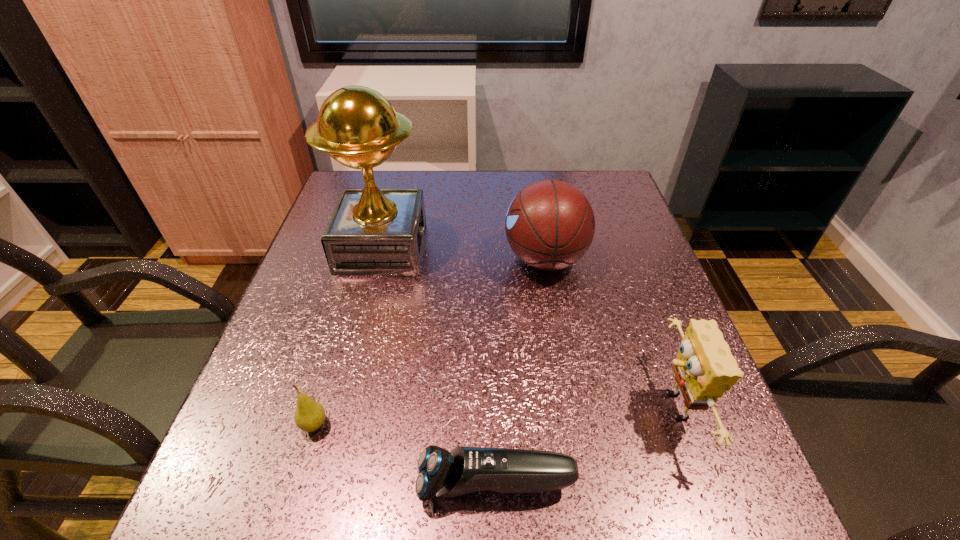
You are a GUI agent. You are given a task and a screenshot of the screen. Output one action in this format:
    pyautogui.click(x=<x>, y=<y>)
    Task: Click on the free space located 0.350m on the face of the sponge
    This screenshot has width=960, height=540.
    Given the screenshot: What is the action you would take?
    pyautogui.click(x=453, y=407)

The height and width of the screenshot is (540, 960). In order to click on vacant space situated 0.390m on the right of the pear in this screenshot , I will do [x=558, y=425].

You are a GUI agent. You are given a task and a screenshot of the screen. Output one action in this format:
    pyautogui.click(x=<x>, y=<y>)
    Task: Click on the vacant point located 0.090m on the head of the electric shaver
    This screenshot has width=960, height=540.
    Given the screenshot: What is the action you would take?
    pyautogui.click(x=360, y=484)

Where is `free space located 0.220m on the head of the electric shaver`? This screenshot has height=540, width=960. free space located 0.220m on the head of the electric shaver is located at coordinates (276, 484).

Find the location of a particular element. The height and width of the screenshot is (540, 960). free location located on the head of the electric shaver is located at coordinates (367, 484).

Locate an element on the screen. This screenshot has height=540, width=960. object situated at the near edge is located at coordinates (463, 470).

Where is `award that is at the left edge`? This screenshot has height=540, width=960. award that is at the left edge is located at coordinates (372, 231).

In order to click on pear positioned at the left edge in this screenshot , I will do `click(309, 416)`.

Locate an element on the screen. The image size is (960, 540). basketball that is at the right edge is located at coordinates (550, 224).

Identify the location of sponge located in the right edge section of the desktop. The image size is (960, 540). (704, 369).